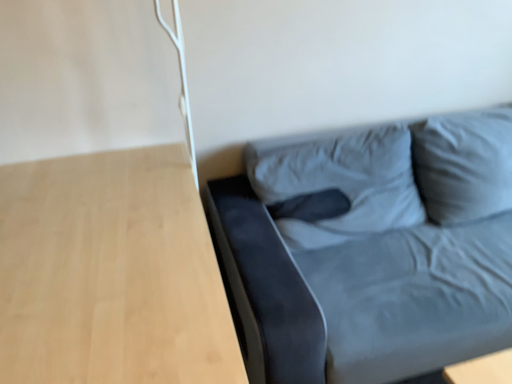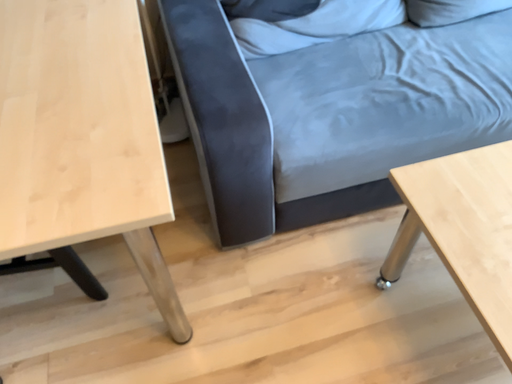
Question: Which way did the camera rotate in the video?

Choices:
 (A) rotated downward
 (B) rotated upward

Answer: (A)